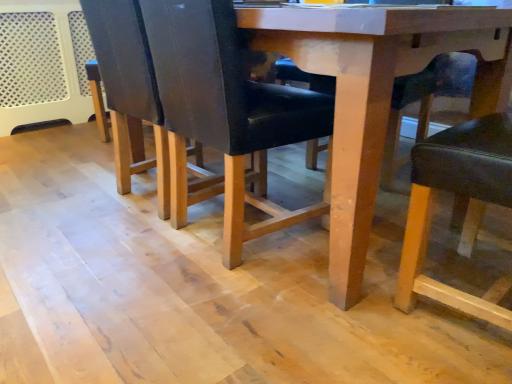
Question: Can you confirm if wooden chair leg at center, the second chair positioned from the front, is shorter than matte black chair at lower right, which is the second chair from back to front?

Choices:
 (A) no
 (B) yes

Answer: (B)

Question: Considering the relative sizes of wooden chair leg at center, the first chair in the back-to-front sequence, and matte black chair at lower right, which ranks as the 1th chair in front-to-back order, in the image provided, is wooden chair leg at center, the first chair in the back-to-front sequence, smaller than matte black chair at lower right, which ranks as the 1th chair in front-to-back order,?

Choices:
 (A) yes
 (B) no

Answer: (B)

Question: Can you confirm if wooden chair leg at center, the second chair positioned from the front, is bigger than matte black chair at lower right, which ranks as the 1th chair in front-to-back order?

Choices:
 (A) no
 (B) yes

Answer: (B)

Question: Is wooden chair leg at center, the second chair positioned from the front, looking in the opposite direction of matte black chair at lower right, which ranks as the 1th chair in front-to-back order?

Choices:
 (A) no
 (B) yes

Answer: (A)

Question: From the image's perspective, is wooden chair leg at center, the second chair positioned from the front, located above matte black chair at lower right, which is the second chair from back to front?

Choices:
 (A) yes
 (B) no

Answer: (A)

Question: Would you consider wooden chair leg at center, the second chair positioned from the front, to be distant from matte black chair at lower right, which is the second chair from back to front?

Choices:
 (A) no
 (B) yes

Answer: (A)

Question: Is matte black chair at lower right, which is the second chair from back to front, bigger than wooden chair leg at center, the second chair positioned from the front?

Choices:
 (A) no
 (B) yes

Answer: (A)

Question: Can you confirm if matte black chair at lower right, which ranks as the 1th chair in front-to-back order, is wider than wooden chair leg at center, the second chair positioned from the front?

Choices:
 (A) yes
 (B) no

Answer: (B)

Question: Is matte black chair at lower right, which is the second chair from back to front, outside wooden chair leg at center, the first chair in the back-to-front sequence?

Choices:
 (A) no
 (B) yes

Answer: (B)

Question: From the image's perspective, is matte black chair at lower right, which is the second chair from back to front, located above wooden chair leg at center, the first chair in the back-to-front sequence?

Choices:
 (A) yes
 (B) no

Answer: (B)

Question: Is wooden chair leg at center, the first chair in the back-to-front sequence, a part of matte black chair at lower right, which ranks as the 1th chair in front-to-back order?

Choices:
 (A) no
 (B) yes

Answer: (A)

Question: From the image's perspective, does matte black chair at lower right, which is the second chair from back to front, appear lower than wooden chair leg at center, the second chair positioned from the front?

Choices:
 (A) no
 (B) yes

Answer: (B)

Question: Choose the correct answer: Is wooden chair leg at center, the first chair in the back-to-front sequence, inside matte black chair at lower right, which is the second chair from back to front, or outside it?

Choices:
 (A) outside
 (B) inside

Answer: (A)